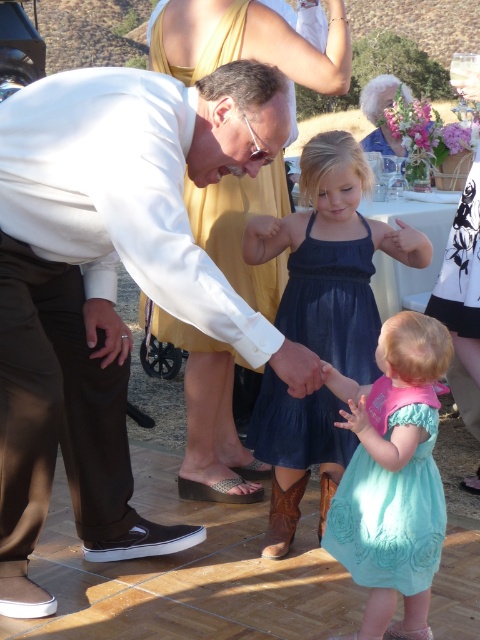
Question: Which point is farther from the camera taking this photo?

Choices:
 (A) (12, 381)
 (B) (454, 83)
 (C) (256, 307)

Answer: (B)

Question: Which of these objects is positioned closest to the white matte shirt at center?

Choices:
 (A) dark blue satin dress at center
 (B) teal satin dress at center
 (C) teal satin dress at lower center

Answer: (A)

Question: Observing the image, what is the correct spatial positioning of white leather shoes at center in reference to white matte shirt at center?

Choices:
 (A) above
 (B) below

Answer: (A)

Question: Does white matte shirt at center have a larger size compared to teal satin dress at center?

Choices:
 (A) yes
 (B) no

Answer: (A)

Question: Is white matte shirt at center positioned before teal satin dress at center?

Choices:
 (A) no
 (B) yes

Answer: (A)

Question: Which object is farther from the camera taking this photo?

Choices:
 (A) teal satin dress at center
 (B) teal satin dress at lower center

Answer: (B)